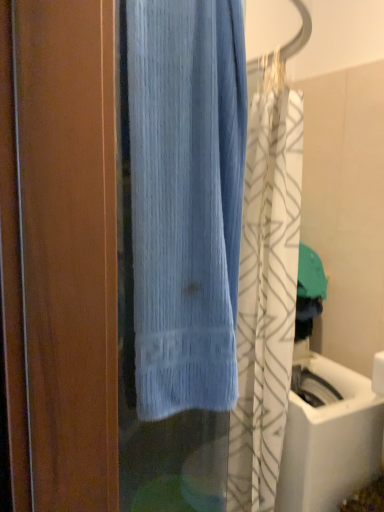
Question: From the image's perspective, would you say white glossy sink at lower right is positioned over light blue fabric at center?

Choices:
 (A) yes
 (B) no

Answer: (B)

Question: Considering the relative sizes of white glossy sink at lower right and light blue fabric at center in the image provided, is white glossy sink at lower right smaller than light blue fabric at center?

Choices:
 (A) yes
 (B) no

Answer: (B)

Question: From the image's perspective, is white glossy sink at lower right under light blue fabric at center?

Choices:
 (A) yes
 (B) no

Answer: (A)

Question: Is light blue fabric at center surrounded by white glossy sink at lower right?

Choices:
 (A) no
 (B) yes

Answer: (A)

Question: Considering the relative positions of white glossy sink at lower right and light blue fabric at center in the image provided, is white glossy sink at lower right to the left of light blue fabric at center from the viewer's perspective?

Choices:
 (A) no
 (B) yes

Answer: (A)

Question: From the image's perspective, relative to light blue fabric at center, is light blue textured towel at center above or below?

Choices:
 (A) below
 (B) above

Answer: (A)

Question: Relative to light blue fabric at center, is light blue textured towel at center in front or behind?

Choices:
 (A) front
 (B) behind

Answer: (B)

Question: From a real-world perspective, is light blue textured towel at center above or below light blue fabric at center?

Choices:
 (A) below
 (B) above

Answer: (A)

Question: In terms of size, does light blue textured towel at center appear bigger or smaller than light blue fabric at center?

Choices:
 (A) big
 (B) small

Answer: (A)

Question: Considering the positions of point (158, 267) and point (289, 413), is point (158, 267) closer or farther from the camera than point (289, 413)?

Choices:
 (A) closer
 (B) farther

Answer: (A)

Question: From a real-world perspective, is light blue fabric at center positioned above or below white glossy sink at lower right?

Choices:
 (A) below
 (B) above

Answer: (B)

Question: Is light blue fabric at center situated inside white glossy sink at lower right or outside?

Choices:
 (A) inside
 (B) outside

Answer: (B)

Question: From their relative heights in the image, would you say light blue fabric at center is taller or shorter than white glossy sink at lower right?

Choices:
 (A) tall
 (B) short

Answer: (B)

Question: Is white glossy sink at lower right in front of or behind light blue fabric at center in the image?

Choices:
 (A) front
 (B) behind

Answer: (B)

Question: Based on their positions, is white glossy sink at lower right located to the left or right of light blue fabric at center?

Choices:
 (A) left
 (B) right

Answer: (B)